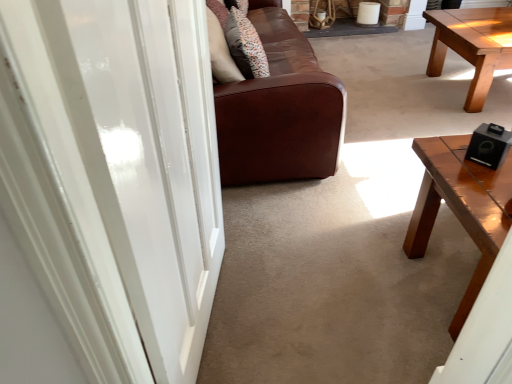
Image resolution: width=512 pixels, height=384 pixels. What are the coordinates of `free spot behind black matte speaker at right` in the screenshot? It's located at (453, 145).